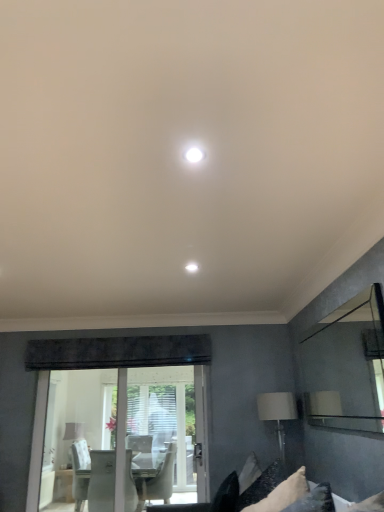
Question: Is clear glass mirror at right smaller than white fabric pillow at lower right?

Choices:
 (A) yes
 (B) no

Answer: (A)

Question: Can you confirm if clear glass mirror at right is bigger than white fabric pillow at lower right?

Choices:
 (A) no
 (B) yes

Answer: (A)

Question: Is clear glass mirror at right aimed at white fabric pillow at lower right?

Choices:
 (A) no
 (B) yes

Answer: (A)

Question: Is clear glass mirror at right at the right side of white fabric pillow at lower right?

Choices:
 (A) no
 (B) yes

Answer: (B)

Question: From the image's perspective, is clear glass mirror at right under white fabric pillow at lower right?

Choices:
 (A) yes
 (B) no

Answer: (B)

Question: From the image's perspective, relative to clear glass mirror at right, is white fabric pillow at lower right above or below?

Choices:
 (A) above
 (B) below

Answer: (B)

Question: Considering their positions, is white fabric pillow at lower right located in front of or behind clear glass mirror at right?

Choices:
 (A) front
 (B) behind

Answer: (B)

Question: In the image, is white fabric pillow at lower right on the left side or the right side of clear glass mirror at right?

Choices:
 (A) left
 (B) right

Answer: (A)

Question: Is white fabric pillow at lower right situated inside clear glass mirror at right or outside?

Choices:
 (A) outside
 (B) inside

Answer: (A)

Question: Does point (198, 148) appear closer or farther from the camera than point (74, 421)?

Choices:
 (A) farther
 (B) closer

Answer: (B)

Question: From a real-world perspective, is white glossy light fixture at center physically located above or below white fabric table lamp at lower left, the first table lamp ordered from the bottom?

Choices:
 (A) below
 (B) above

Answer: (B)

Question: Visually, is white glossy light fixture at center positioned to the left or to the right of white fabric table lamp at lower left, which appears as the second table lamp when viewed from the front?

Choices:
 (A) right
 (B) left

Answer: (A)

Question: Considering the positions of white glossy light fixture at center and white fabric table lamp at lower left, which is counted as the 1th table lamp, starting from the left, in the image, is white glossy light fixture at center bigger or smaller than white fabric table lamp at lower left, which is counted as the 1th table lamp, starting from the left,?

Choices:
 (A) big
 (B) small

Answer: (B)

Question: Would you say white fabric lampshade at lower right, arranged as the second table lamp when ordered from the bottom, is to the left or to the right of white fabric pillow at lower right in the picture?

Choices:
 (A) left
 (B) right

Answer: (B)

Question: Looking at their shapes, would you say white fabric lampshade at lower right, positioned as the second table lamp in back-to-front order, is wider or thinner than white fabric pillow at lower right?

Choices:
 (A) thin
 (B) wide

Answer: (A)